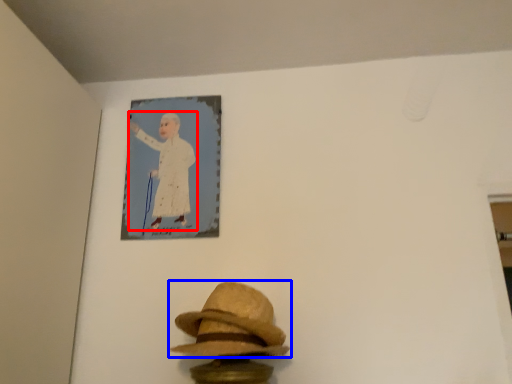
Question: Among these objects, which one is farthest to the camera, person (highlighted by a red box) or fedora (highlighted by a blue box)?

Choices:
 (A) person
 (B) fedora

Answer: (A)